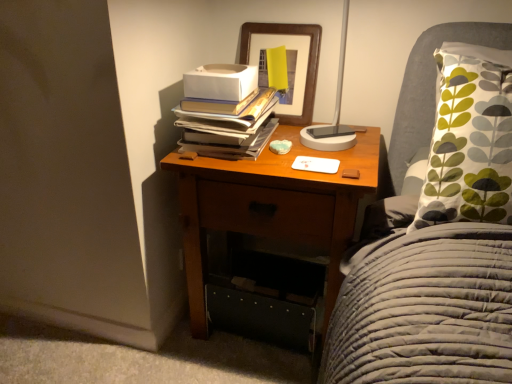
Image resolution: width=512 pixels, height=384 pixels. What do you see at coordinates (274, 206) in the screenshot? I see `wooden nightstand at center` at bounding box center [274, 206].

I want to click on wooden picture frame at upper center, so click(308, 63).

This screenshot has height=384, width=512. I want to click on wooden nightstand at center, so click(x=274, y=206).

Is wooden nightstand at center oriented towards hardcover books at upper center?

No.

From a real-world perspective, is wooden nightstand at center physically located above or below hardcover books at upper center?

Clearly, from a real-world perspective, wooden nightstand at center is below hardcover books at upper center.

Is wooden nightstand at center located outside hardcover books at upper center?

Yes, wooden nightstand at center is not within hardcover books at upper center.

Can you see wooden nightstand at center touching hardcover books at upper center?

No, wooden nightstand at center is not with hardcover books at upper center.

Can you tell me how much hardcover books at upper center and wooden picture frame at upper center differ in facing direction?

hardcover books at upper center and wooden picture frame at upper center are facing 1.83 degrees away from each other.

Between hardcover books at upper center and wooden picture frame at upper center, which one appears on the left side from the viewer's perspective?

From the viewer's perspective, hardcover books at upper center appears more on the left side.

Is point (274, 98) positioned after point (313, 58)?

Yes, point (274, 98) is behind point (313, 58).

Considering the relative sizes of hardcover books at upper center and wooden picture frame at upper center in the image provided, is hardcover books at upper center bigger than wooden picture frame at upper center?

No.

Considering their positions, is hardcover books at upper center located in front of or behind wooden nightstand at center?

Visually, hardcover books at upper center is located behind wooden nightstand at center.

From a real-world perspective, is hardcover books at upper center physically above wooden nightstand at center?

Yes, from a real-world perspective, hardcover books at upper center is on top of wooden nightstand at center.

How different are the orientations of hardcover books at upper center and wooden nightstand at center in degrees?

The facing directions of hardcover books at upper center and wooden nightstand at center are 1.83 degrees apart.

In the image, is hardcover books at upper center on the left side or the right side of wooden nightstand at center?

In the image, hardcover books at upper center appears on the left side of wooden nightstand at center.

Where is `picture frame above the hardcover books at upper center (from a real-world perspective)`? Image resolution: width=512 pixels, height=384 pixels. picture frame above the hardcover books at upper center (from a real-world perspective) is located at coordinates (308, 63).

Does wooden picture frame at upper center come behind hardcover books at upper center?

Yes, wooden picture frame at upper center is further from the camera.

From the image's perspective, is wooden picture frame at upper center over hardcover books at upper center?

Correct, wooden picture frame at upper center appears higher than hardcover books at upper center in the image.

Between wooden picture frame at upper center and hardcover books at upper center, which one has more height?

wooden picture frame at upper center.

Which is behind, point (296, 32) or point (302, 178)?

The point (296, 32) is more distant.

Would you consider wooden picture frame at upper center to be distant from wooden nightstand at center?

No, wooden picture frame at upper center is not far away from wooden nightstand at center.

Is wooden picture frame at upper center in front of or behind wooden nightstand at center in the image?

wooden picture frame at upper center is positioned farther from the viewer than wooden nightstand at center.

Does point (273, 176) come in front of point (252, 24)?

That is True.

Which object is positioned more to the right, wooden nightstand at center or wooden picture frame at upper center?

wooden nightstand at center is more to the right.

From the image's perspective, is wooden nightstand at center over wooden picture frame at upper center?

No, from the image's perspective, wooden nightstand at center is not over wooden picture frame at upper center.

Is wooden nightstand at center far from wooden picture frame at upper center?

That's not correct — wooden nightstand at center is a little close to wooden picture frame at upper center.

I want to click on nightstand that appears below the hardcover books at upper center (from the image's perspective), so (x=274, y=206).

This screenshot has height=384, width=512. Identify the location of book on the left of wooden picture frame at upper center. (230, 129).

Which object lies further to the anchor point wooden picture frame at upper center, wooden nightstand at center or hardcover books at upper center?

Based on the image, wooden nightstand at center appears to be further to wooden picture frame at upper center.

From the image, which object appears to be farther from wooden nightstand at center, wooden picture frame at upper center or hardcover books at upper center?

wooden picture frame at upper center lies further to wooden nightstand at center than the other object.

Considering their positions, is wooden nightstand at center positioned closer to hardcover books at upper center than wooden picture frame at upper center?

Based on the image, wooden nightstand at center appears to be nearer to hardcover books at upper center.

Considering their positions, is wooden picture frame at upper center positioned closer to hardcover books at upper center than wooden nightstand at center?

Based on the image, wooden nightstand at center appears to be nearer to hardcover books at upper center.

In the scene shown: Estimate the real-world distances between objects in this image. Which object is closer to wooden nightstand at center, hardcover books at upper center or wooden picture frame at upper center?

Based on the image, hardcover books at upper center appears to be nearer to wooden nightstand at center.

Considering their positions, is hardcover books at upper center positioned further to wooden picture frame at upper center than wooden nightstand at center?

wooden nightstand at center is further to wooden picture frame at upper center.

Locate an element on the screen. Image resolution: width=512 pixels, height=384 pixels. book between wooden picture frame at upper center and wooden nightstand at center in the vertical direction is located at coordinates (230, 129).